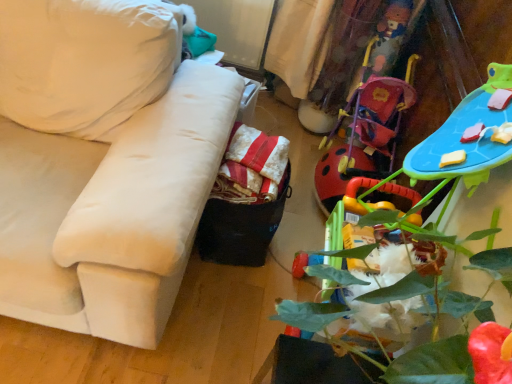
Question: From a real-world perspective, is velvet white couch at left physically above red striped fabric at center?

Choices:
 (A) yes
 (B) no

Answer: (A)

Question: Is velvet white couch at left further to the viewer compared to red striped fabric at center?

Choices:
 (A) no
 (B) yes

Answer: (A)

Question: Is velvet white couch at left placed right next to red striped fabric at center?

Choices:
 (A) yes
 (B) no

Answer: (B)

Question: Is velvet white couch at left facing towards red striped fabric at center?

Choices:
 (A) yes
 (B) no

Answer: (B)

Question: Is velvet white couch at left facing away from red striped fabric at center?

Choices:
 (A) no
 (B) yes

Answer: (A)

Question: Choose the correct answer: Is red striped fabric at center inside velvet white couch at left or outside it?

Choices:
 (A) outside
 (B) inside

Answer: (A)

Question: From their relative heights in the image, would you say red striped fabric at center is taller or shorter than velvet white couch at left?

Choices:
 (A) tall
 (B) short

Answer: (B)

Question: Is red striped fabric at center in front of or behind velvet white couch at left in the image?

Choices:
 (A) front
 (B) behind

Answer: (B)

Question: Is point (279, 160) positioned closer to the camera than point (66, 249)?

Choices:
 (A) farther
 (B) closer

Answer: (A)

Question: In terms of size, does green leafy plant at lower right appear bigger or smaller than red striped fabric at center?

Choices:
 (A) big
 (B) small

Answer: (A)

Question: Considering the relative positions of green leafy plant at lower right and red striped fabric at center in the image provided, is green leafy plant at lower right to the left or to the right of red striped fabric at center?

Choices:
 (A) left
 (B) right

Answer: (B)

Question: Is green leafy plant at lower right inside the boundaries of red striped fabric at center, or outside?

Choices:
 (A) inside
 (B) outside

Answer: (B)

Question: From the image's perspective, relative to red striped fabric at center, is green leafy plant at lower right above or below?

Choices:
 (A) above
 (B) below

Answer: (B)

Question: Is point (275, 142) closer or farther from the camera than point (392, 375)?

Choices:
 (A) closer
 (B) farther

Answer: (B)

Question: From a real-world perspective, relative to green leafy plant at lower right, is red striped fabric at center vertically above or below?

Choices:
 (A) above
 (B) below

Answer: (B)